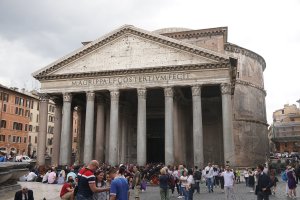
Where is `large doorway`? The height and width of the screenshot is (200, 300). large doorway is located at coordinates (155, 148).